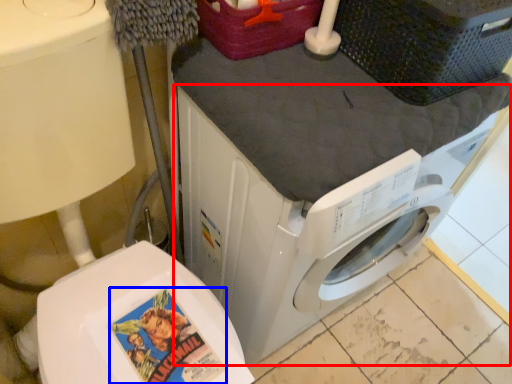
Question: Which of the following is the closest to the observer, washing machine (highlighted by a red box) or comic book character (highlighted by a blue box)?

Choices:
 (A) washing machine
 (B) comic book character

Answer: (A)